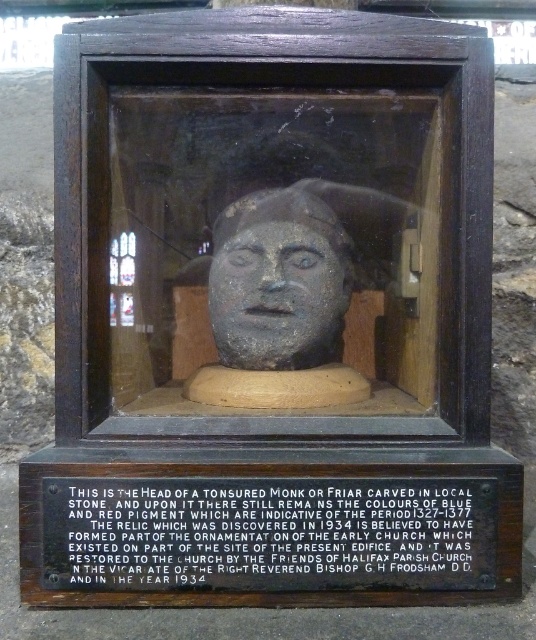
Can you confirm if black wood plaque at lower center is bigger than matte stone head at center?

Actually, black wood plaque at lower center might be smaller than matte stone head at center.

Can you confirm if black wood plaque at lower center is smaller than matte stone head at center?

Yes.

Which is in front, point (465, 538) or point (224, 300)?

Point (465, 538)

Find the location of a particular element. The image size is (536, 640). black wood plaque at lower center is located at coordinates (265, 531).